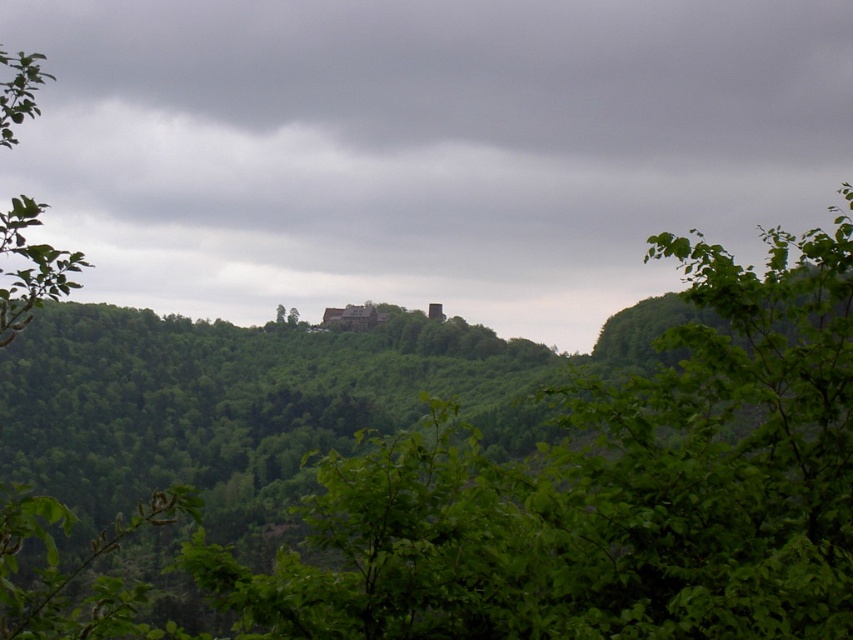
You are an explorer navigating through the forest depicted in the image. You need to reach the structure on the hill but first must pass between the green leafy tree at center and the green leafy tree at left. Can you walk directly between them without going around?

The green leafy tree at center is positioned under the green leafy tree at left, meaning they are stacked vertically rather than side by side. Therefore, you cannot walk directly between them as they are aligned one above the other.

You are standing in the forest and see both the green leafy tree at center and the green leafy tree at left. Which tree is positioned more to the right side of your view?

The green leafy tree at center is positioned more to the right side of your view compared to the green leafy tree at left.